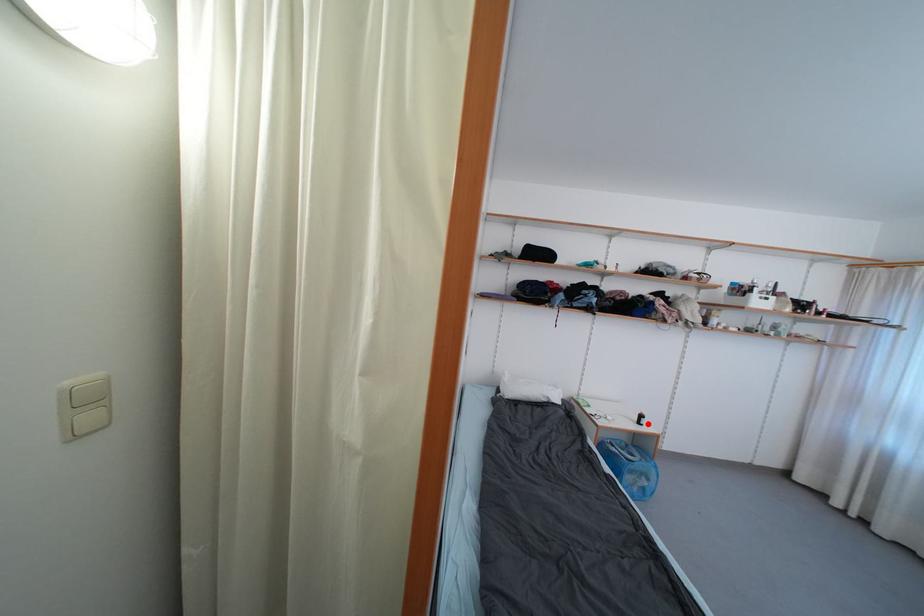
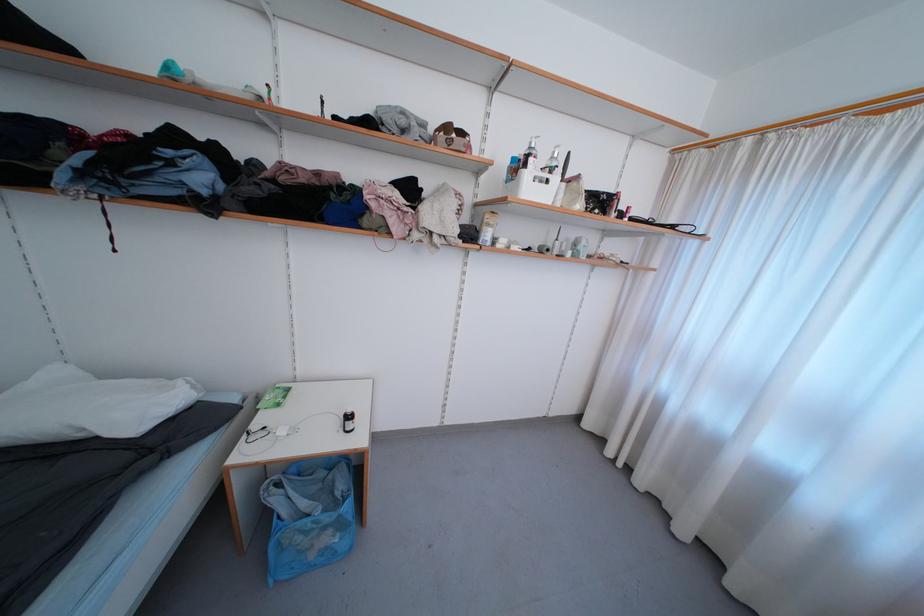
Find the pixel in the second image that matches the highlighted location in the first image.

(354, 429)